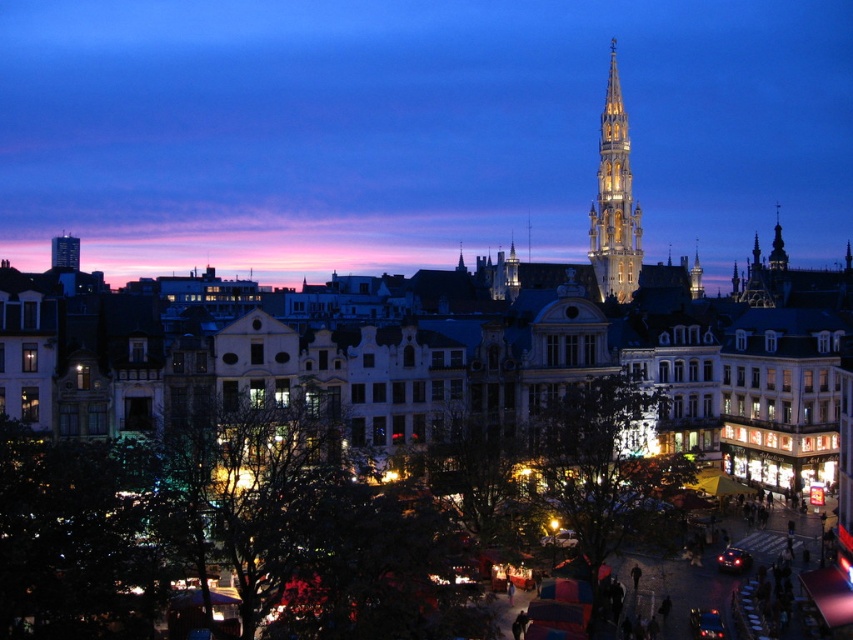
You are an architect analyzing the urban layout of the city depicted in the image. You notice the matte stone tower at upper center and the illuminated stone spire at upper right. Which structure is located higher in the image?

The matte stone tower at upper center is positioned over the illuminated stone spire at upper right, so it is higher in the image.

You are standing at the point marked as point (x=415, y=131) in the image. What object is located exactly at this point?

The object located exactly at point (x=415, y=131) is the matte stone tower at upper center.

Based on the photo, you are a tourist standing at the market stalls and looking up at the buildings. Which structure is positioned more to the left side of your view between the matte stone tower at upper center and the illuminated stone spire at upper right?

The matte stone tower at upper center is positioned more to the left side of your view compared to the illuminated stone spire at upper right.